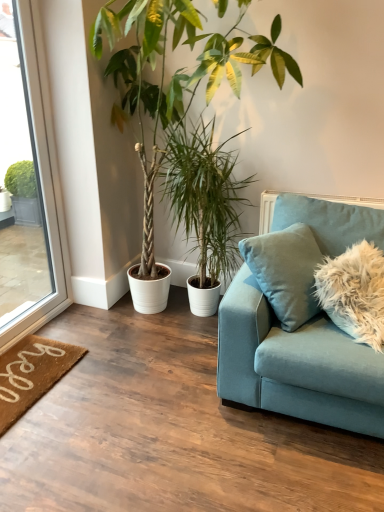
In order to click on vacant area in front of green leafy plant at upper left, positioned as the second houseplant in right-to-left order in this screenshot , I will do [x=141, y=415].